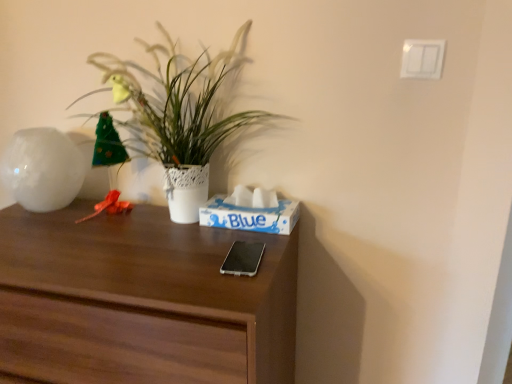
The width and height of the screenshot is (512, 384). What are the coordinates of `vacant space situated on the left part of blue paper tissue box at center` in the screenshot? It's located at (169, 230).